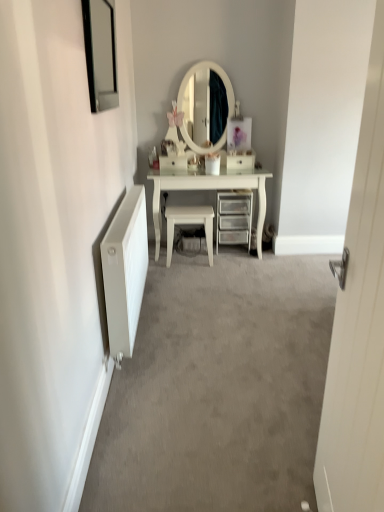
Question: In terms of height, does white radiator at left look taller or shorter compared to white matte radiator at left?

Choices:
 (A) tall
 (B) short

Answer: (B)

Question: Considering their positions, is white radiator at left located in front of or behind white matte radiator at left?

Choices:
 (A) front
 (B) behind

Answer: (A)

Question: Which object is positioned farthest from the white glossy stool at center?

Choices:
 (A) white glossy drawer at center
 (B) black glass picture frame at upper left
 (C) clear plastic drawers at center
 (D) white matte radiator at left
 (E) white radiator at left

Answer: (B)

Question: Estimate the real-world distances between objects in this image. Which object is closer to the white matte radiator at left?

Choices:
 (A) white radiator at left
 (B) clear plastic drawers at center
 (C) white wooden door at right
 (D) white glossy stool at center
 (E) black glass picture frame at upper left

Answer: (A)